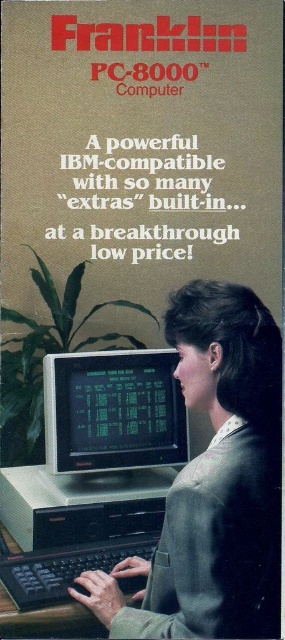
Between point (182, 547) and point (129, 435), which one is positioned behind?

Point (129, 435)

Between point (208, 285) and point (84, 452), which one is positioned in front?

Positioned in front is point (208, 285).

The width and height of the screenshot is (285, 640). Identify the location of matte gray suit at center. (214, 483).

Locate an element on the screen. This screenshot has width=285, height=640. matte gray suit at center is located at coordinates (214, 483).

Does matte gray suit at center appear over black plastic keyboard at lower center?

Correct, matte gray suit at center is located above black plastic keyboard at lower center.

The height and width of the screenshot is (640, 285). Describe the element at coordinates (214, 483) in the screenshot. I see `matte gray suit at center` at that location.

Image resolution: width=285 pixels, height=640 pixels. What are the coordinates of `matte gray suit at center` in the screenshot? It's located at (214, 483).

Which of these two, green matte monitor at center or black plastic keyboard at lower center, stands shorter?

black plastic keyboard at lower center

Is point (98, 372) positioned before point (82, 556)?

That is False.

The width and height of the screenshot is (285, 640). What do you see at coordinates (112, 412) in the screenshot?
I see `green matte monitor at center` at bounding box center [112, 412].

At what (x,y) coordinates should I click in order to perform the action: click on green matte monitor at center. Please return your answer as a coordinate pair (x, y). Looking at the image, I should click on (112, 412).